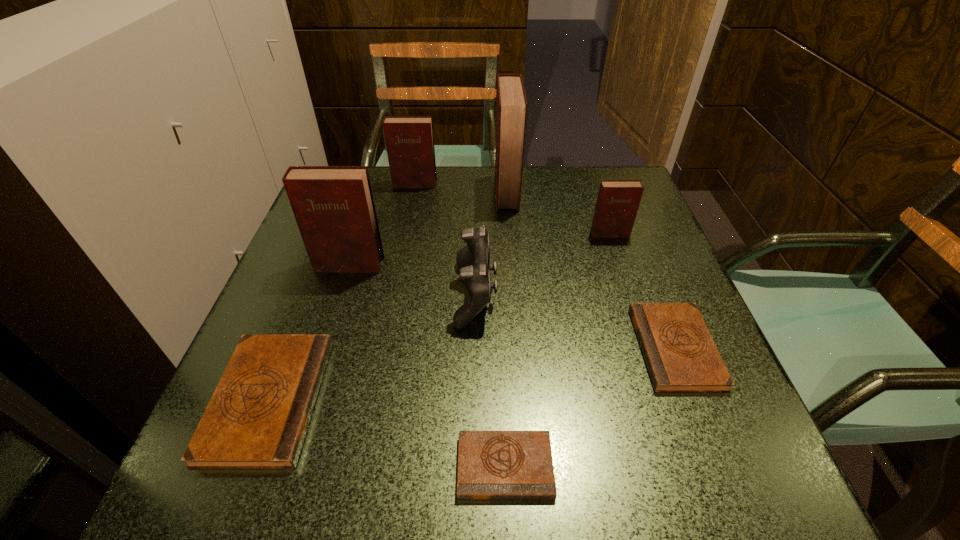
Identify the location of vacant region between the tallest diary and the nearest reddish-brown diary. (428, 228).

Find the location of a particular element. empty location between the shortest diary and the second biggest brown diary is located at coordinates (590, 407).

You are a GUI agent. You are given a task and a screenshot of the screen. Output one action in this format:
    pyautogui.click(x=<x>, y=<y>)
    Task: Click on the free space between the tallest diary and the seventh shortest object
    
    Given the screenshot: What is the action you would take?
    pyautogui.click(x=428, y=228)

Where is `empty space that is in between the second reddish-brown diary from right to left and the shortest object`? empty space that is in between the second reddish-brown diary from right to left and the shortest object is located at coordinates (506, 329).

This screenshot has width=960, height=540. Identify the location of object that is the seventh closest to the fifth nearest diary. (257, 418).

The image size is (960, 540). What are the coordinates of `the closest object relative to the third smallest reddish-brown diary` in the screenshot? It's located at (473, 260).

Locate which diary is the sixth closest to the sixth tallest diary. Please provide its 2D coordinates. Your answer should be formatted as a tuple, i.e. [(x, y)], where the tuple contains the x and y coordinates of a point satisfying the conditions above.

[(409, 140)]

Find the location of a particular element. The image size is (960, 540). diary that is the second closest one to the fifth shortest diary is located at coordinates (334, 208).

The height and width of the screenshot is (540, 960). Identify the location of reddish-brown diary object that ranks as the fourth closest to the control. (409, 140).

Identify the location of reddish-brown diary that is the second closest to the second tallest diary. This screenshot has height=540, width=960. (511, 110).